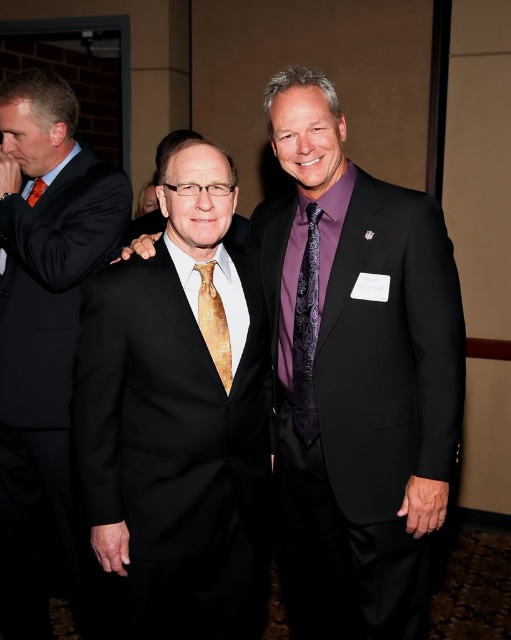
You are organizing a charity event and need to ensure that all donated items fit into a storage box. You have a matte black suit at center and an orange silk tie at left. Which item will require more space in the box?

The matte black suit at center is larger in size than the orange silk tie at left, so it will require more space in the box.

You are a photographer at a formal event and need to adjust your camera focus. Which object is closer to you between the matte black suit at center and the orange silk tie at left?

The matte black suit at center is closer to the viewer than the orange silk tie at left, so you should focus on the matte black suit at center.